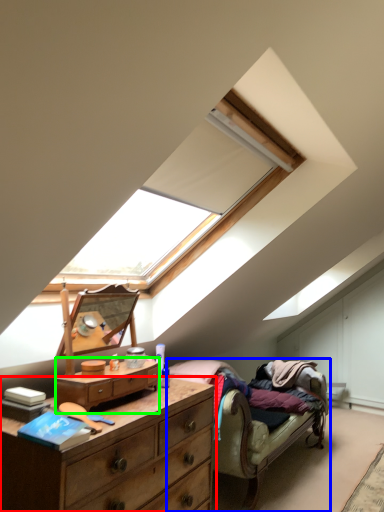
Question: Estimate the real-world distances between objects in this image. Which object is closer to chest of drawers (highlighted by a red box), studio couch (highlighted by a blue box) or chest of drawers (highlighted by a green box)?

Choices:
 (A) studio couch
 (B) chest of drawers

Answer: (B)